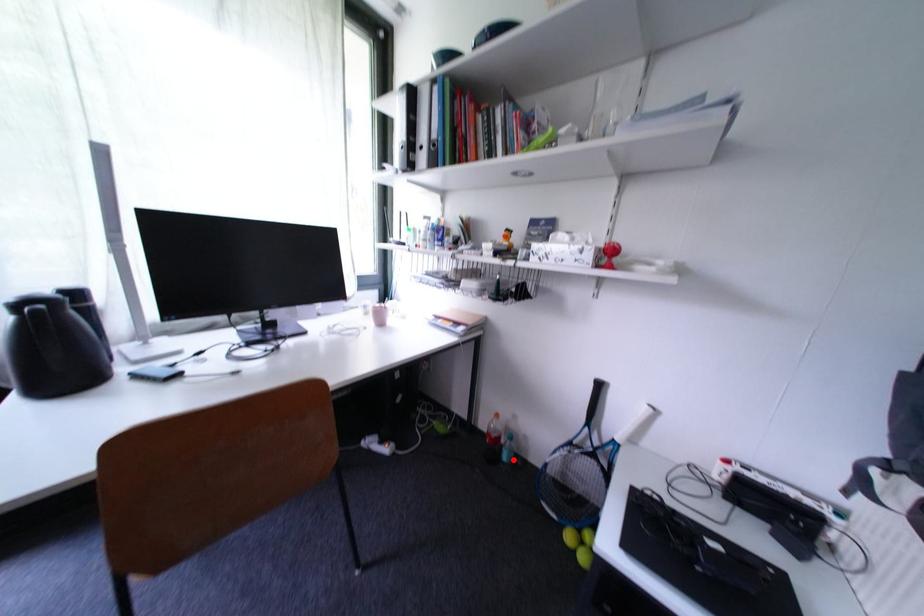
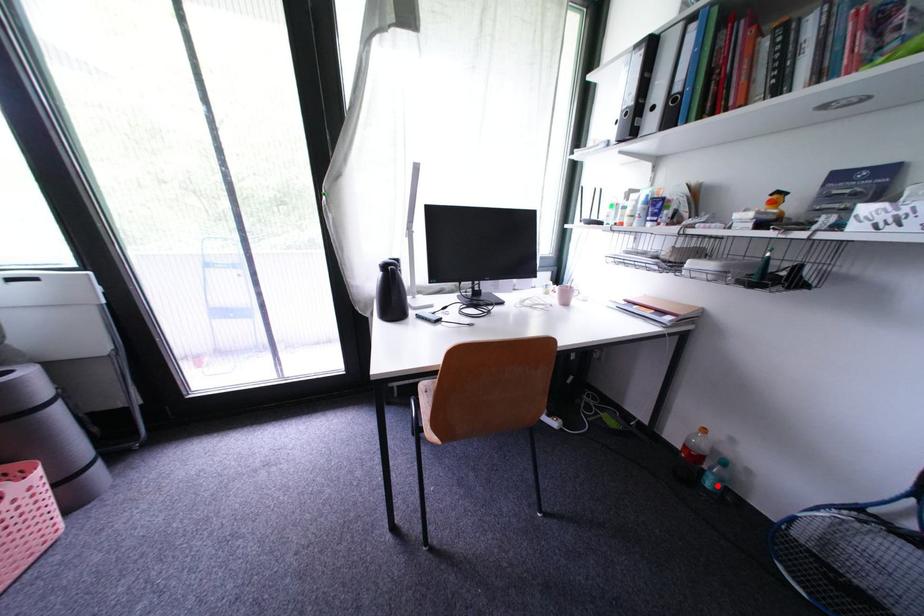
I am providing you with two images of the same scene from different viewpoints. A red point is marked on the first image and another point is marked on the second image. Are the points marked in image1 and image2 representing the same 3D position?

Yes